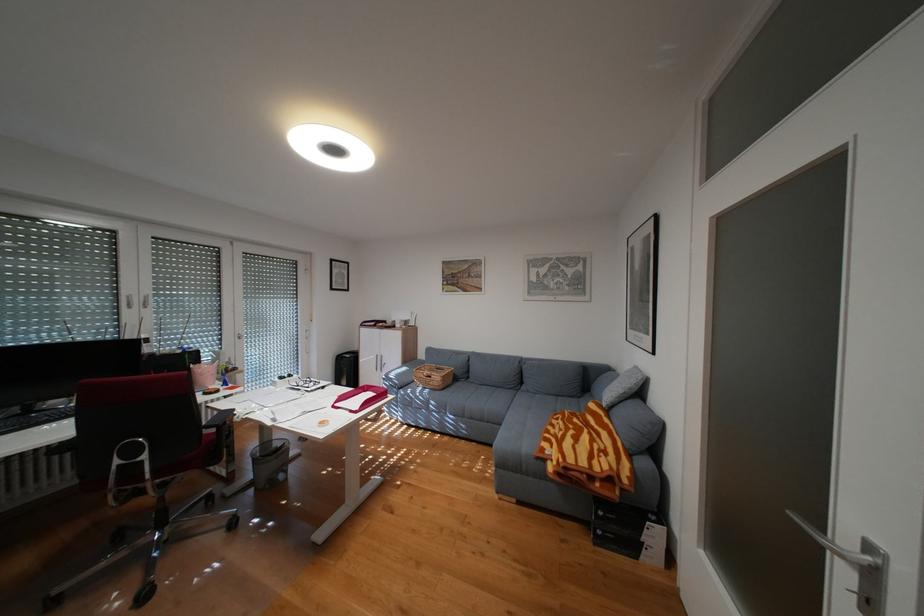
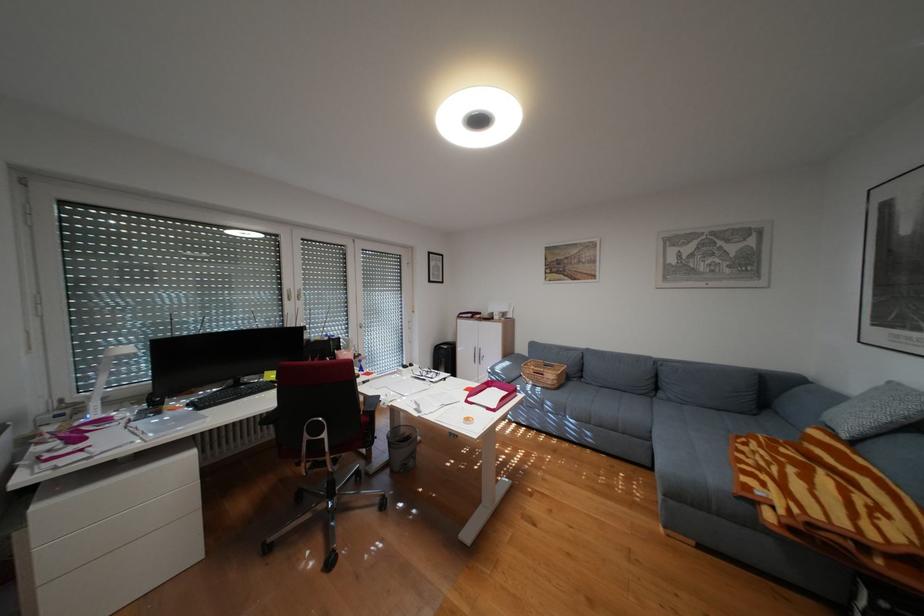
Question: The camera is either moving clockwise (left) or counter-clockwise (right) around the object. The first image is from the beginning of the video and the second image is from the end. Is the camera moving left or right when shooting the video?

Choices:
 (A) Left
 (B) Right

Answer: (B)